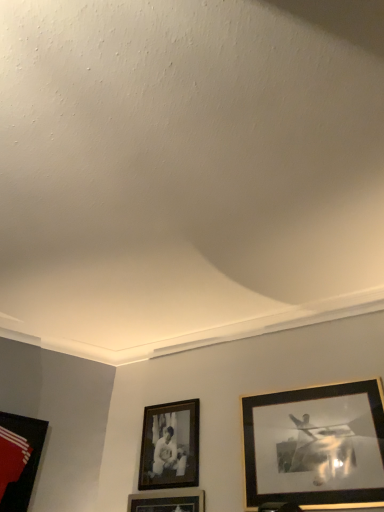
Question: Are matte black picture frame at lower left, the 3th picture frame from the right, and gold-framed picture at right, the first picture frame when ordered from right to left, beside each other?

Choices:
 (A) yes
 (B) no

Answer: (B)

Question: Can we say matte black picture frame at lower left, positioned as the 1th picture frame in left-to-right order, lies outside gold-framed picture at right, which is the 3th picture frame in left-to-right order?

Choices:
 (A) yes
 (B) no

Answer: (A)

Question: Can you confirm if matte black picture frame at lower left, positioned as the 1th picture frame in left-to-right order, is positioned to the left of gold-framed picture at right, the first picture frame when ordered from right to left?

Choices:
 (A) no
 (B) yes

Answer: (B)

Question: Is matte black picture frame at lower left, the 3th picture frame from the right, facing away from gold-framed picture at right, the first picture frame when ordered from right to left?

Choices:
 (A) no
 (B) yes

Answer: (A)

Question: From a real-world perspective, is matte black picture frame at lower left, the 3th picture frame from the right, beneath gold-framed picture at right, which is the 3th picture frame in left-to-right order?

Choices:
 (A) yes
 (B) no

Answer: (A)

Question: From their relative heights in the image, would you say matte black picture frame at lower left, the 3th picture frame from the right, is taller or shorter than black matte picture frame at center, the second picture frame in the right-to-left sequence?

Choices:
 (A) short
 (B) tall

Answer: (B)

Question: Based on their sizes in the image, would you say matte black picture frame at lower left, the 3th picture frame from the right, is bigger or smaller than black matte picture frame at center, the 2th picture frame when ordered from left to right?

Choices:
 (A) small
 (B) big

Answer: (B)

Question: Relative to black matte picture frame at center, the second picture frame in the right-to-left sequence, is matte black picture frame at lower left, positioned as the 1th picture frame in left-to-right order, in front or behind?

Choices:
 (A) behind
 (B) front

Answer: (B)

Question: Visually, is matte black picture frame at lower left, positioned as the 1th picture frame in left-to-right order, positioned to the left or to the right of black matte picture frame at center, the second picture frame in the right-to-left sequence?

Choices:
 (A) right
 (B) left

Answer: (B)

Question: From their relative heights in the image, would you say gold-framed picture at right, the first picture frame when ordered from right to left, is taller or shorter than black matte picture frame at center, the 2th picture frame when ordered from left to right?

Choices:
 (A) tall
 (B) short

Answer: (A)

Question: Considering the positions of gold-framed picture at right, which is the 3th picture frame in left-to-right order, and black matte picture frame at center, the 2th picture frame when ordered from left to right, in the image, is gold-framed picture at right, which is the 3th picture frame in left-to-right order, bigger or smaller than black matte picture frame at center, the 2th picture frame when ordered from left to right,?

Choices:
 (A) big
 (B) small

Answer: (A)

Question: Is point (271, 422) closer or farther from the camera than point (180, 423)?

Choices:
 (A) farther
 (B) closer

Answer: (B)

Question: From the image's perspective, is gold-framed picture at right, the first picture frame when ordered from right to left, located above or below black matte picture frame at center, the second picture frame in the right-to-left sequence?

Choices:
 (A) above
 (B) below

Answer: (A)

Question: Is black matte picture frame at center, the 2th picture frame when ordered from left to right, in front of or behind matte black picture frame at lower left, the 3th picture frame from the right, in the image?

Choices:
 (A) front
 (B) behind

Answer: (B)

Question: From the image's perspective, relative to matte black picture frame at lower left, positioned as the 1th picture frame in left-to-right order, is black matte picture frame at center, the 2th picture frame when ordered from left to right, above or below?

Choices:
 (A) above
 (B) below

Answer: (A)